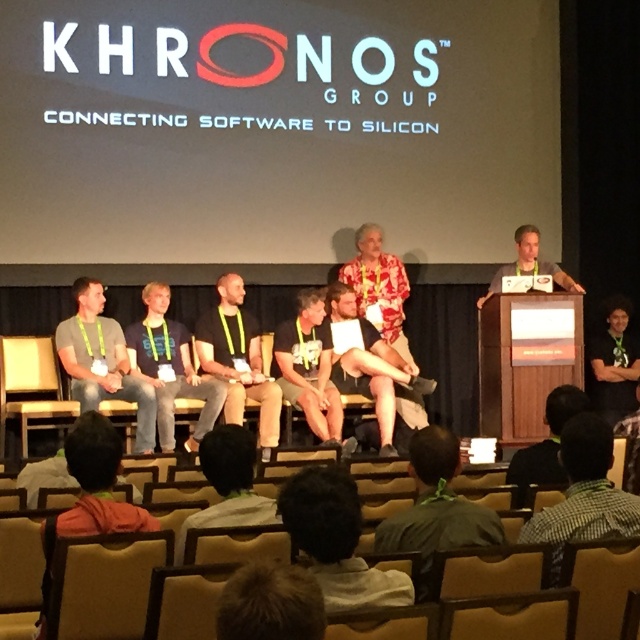
Question: Which object is positioned farthest from the light brown wood podium at right?

Choices:
 (A) gray casual shirt at left
 (B) dark gray t-shirt at center
 (C) dark gray shirt at center

Answer: (A)

Question: Which object is closer to the camera taking this photo?

Choices:
 (A) light brown leather shorts at center
 (B) green fabric shirt at lower center
 (C) gray casual shirt at left
 (D) light brown leather jacket at lower center

Answer: (B)

Question: Does green checkered shirt at lower right lie behind hawaiian print shirt at center?

Choices:
 (A) yes
 (B) no

Answer: (B)

Question: Which point is farther from the camera taking this photo?

Choices:
 (A) (556, 438)
 (B) (170, 323)
 (C) (445, 436)

Answer: (B)

Question: Does light brown leather shorts at center appear under light brown leather jacket at lower center?

Choices:
 (A) no
 (B) yes

Answer: (A)

Question: Does green fabric shirt at lower center have a larger size compared to hawaiian print shirt at center?

Choices:
 (A) no
 (B) yes

Answer: (A)